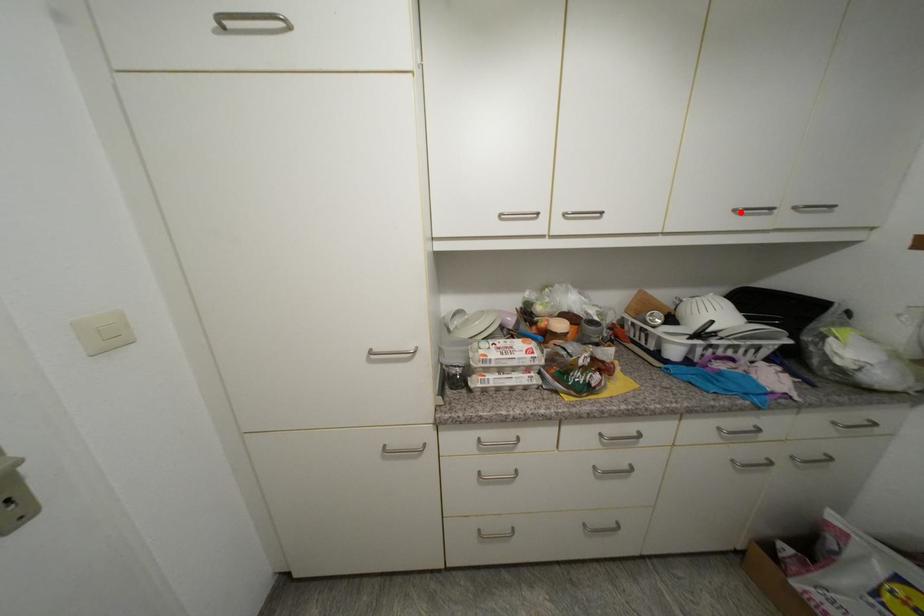
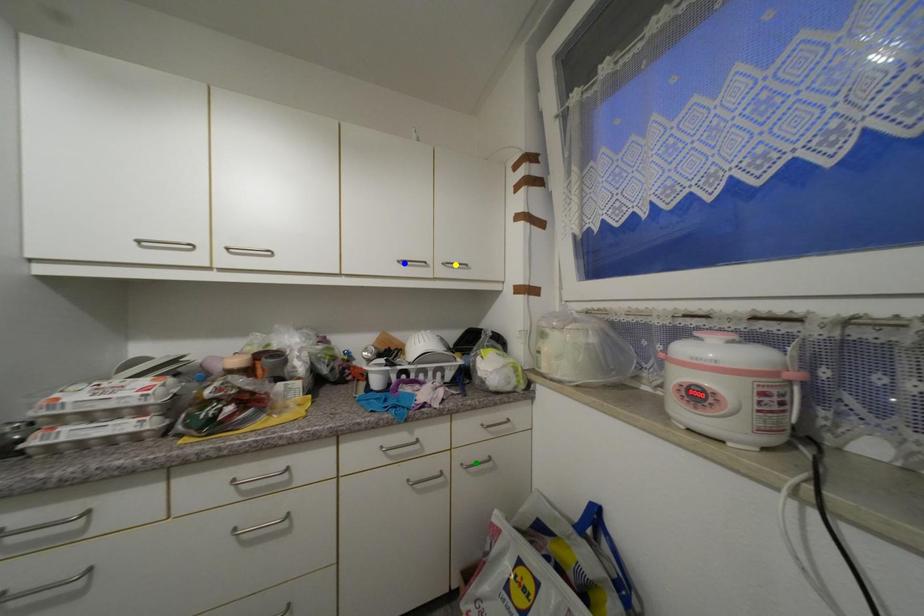
Question: I am providing you with two images of the same scene from different viewpoints. A red point is marked on the first image. You are given multiple points on the second image. In image 2, which mark is for the same physical point as the one in image 1?

Choices:
 (A) blue point
 (B) green point
 (C) yellow point

Answer: (A)